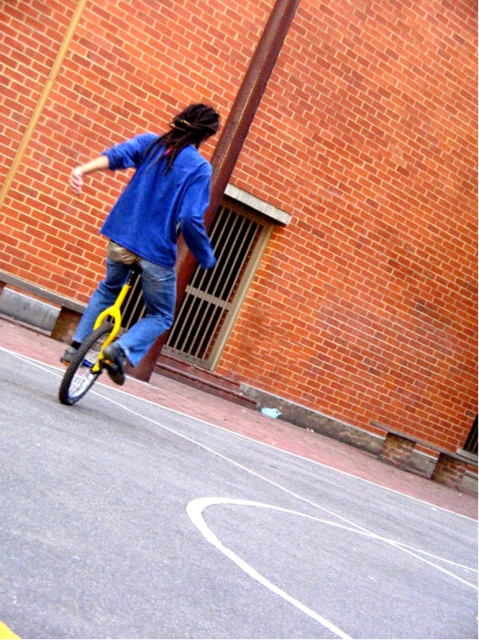
Question: Is blue denim jacket at center further to the viewer compared to yellow matte bicycle at lower left?

Choices:
 (A) no
 (B) yes

Answer: (A)

Question: Which point is closer to the camera?

Choices:
 (A) yellow matte bicycle at lower left
 (B) blue denim jacket at center

Answer: (B)

Question: Which of the following is the closest to the observer?

Choices:
 (A) (76, 397)
 (B) (156, 212)

Answer: (B)

Question: Where is blue denim jacket at center located in relation to yellow matte bicycle at lower left in the image?

Choices:
 (A) right
 (B) left

Answer: (A)

Question: Where is blue denim jacket at center located in relation to yellow matte bicycle at lower left in the image?

Choices:
 (A) right
 (B) left

Answer: (A)

Question: Which of the following is the closest to the observer?

Choices:
 (A) yellow matte bicycle at lower left
 (B) blue denim jacket at center

Answer: (B)